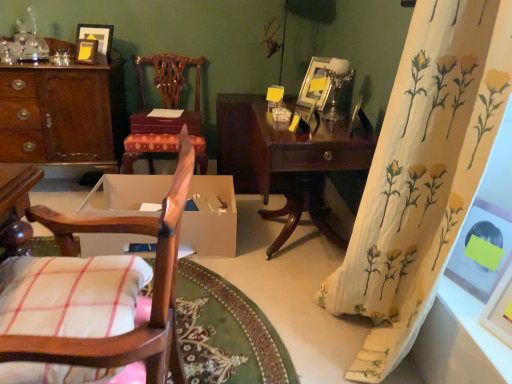
Find the location of a particular element. vacant region below mahogany wood table at center (from a real-world perspective) is located at coordinates (305, 246).